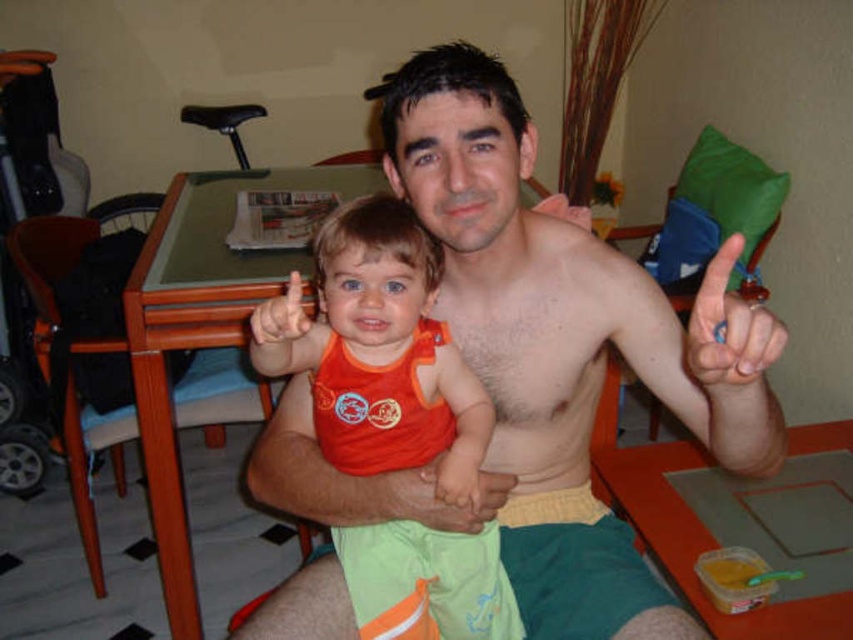
You are a photographer trying to capture the perfect shot of the shiny orange tank top at center and the orange fabric toddler at center. Since you want to focus on the toddler, which object should you zoom in on more to ensure it fills the frame better?

The orange fabric toddler at center has a smaller width than the shiny orange tank top at center. To focus on the toddler, you should zoom in more on the orange fabric toddler at center to make it fill the frame better.

You are a photographer trying to capture the perfect shot of the shiny orange tank top at center and the orange fabric toddler at center. Since you want both subjects to be in focus, you need to adjust your camera settings so that the depth of field can cover both objects. Given their relative sizes, which object should you focus on to ensure both are sharp?

The shiny orange tank top at center is taller than the orange fabric toddler at center, so focusing on the shiny orange tank top at center will ensure both are in focus as it is the larger object in the frame.